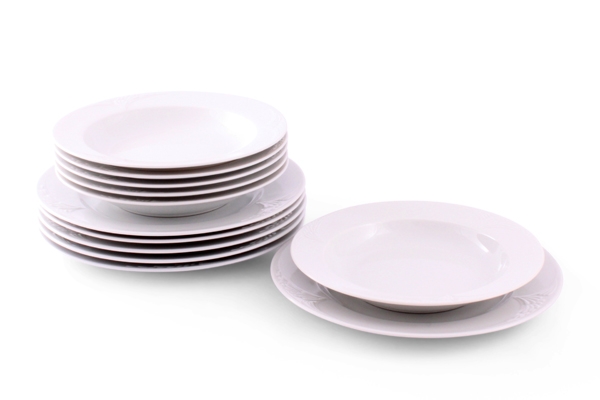
Find the location of a particular element. plate is located at coordinates [345, 324], [206, 269], [210, 260], [221, 246], [238, 233], [244, 227].